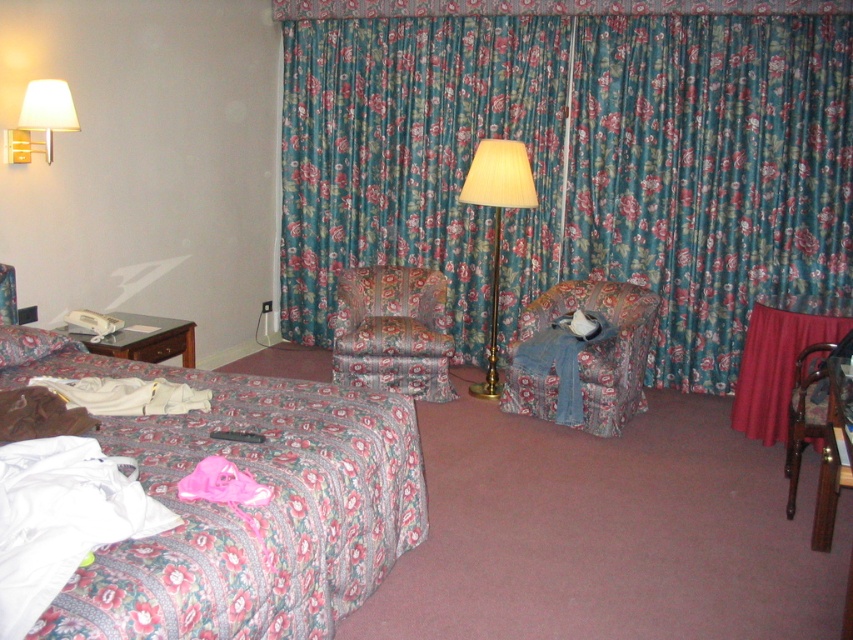
Question: Which point is closer to the camera taking this photo?

Choices:
 (A) (592, 426)
 (B) (422, 368)

Answer: (A)

Question: Is floral fabric armchair at center wider than ivory fabric lamp at center?

Choices:
 (A) no
 (B) yes

Answer: (B)

Question: Which of the following is the farthest from the observer?

Choices:
 (A) ivory fabric lamp at center
 (B) floral fabric curtains at center
 (C) wooden armchair at right
 (D) white fabric lampshade at upper left

Answer: (A)

Question: Which point is farther to the camera?

Choices:
 (A) ivory fabric lamp at center
 (B) floral fabric curtains at center
 (C) wooden armchair at right

Answer: (A)

Question: Is the position of wooden armchair at right more distant than that of white fabric lampshade at upper left?

Choices:
 (A) no
 (B) yes

Answer: (A)

Question: Is ivory fabric lamp at center below wooden armchair at right?

Choices:
 (A) yes
 (B) no

Answer: (B)